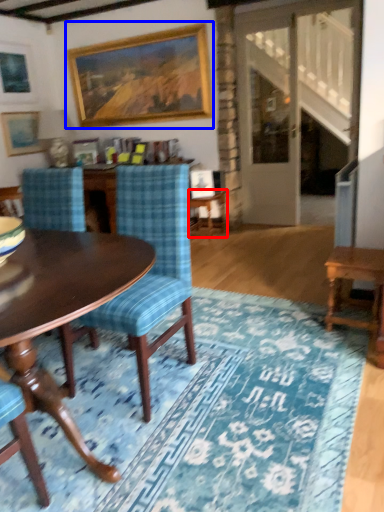
Question: Which object is closer to the camera taking this photo, side table (highlighted by a red box) or picture frame (highlighted by a blue box)?

Choices:
 (A) side table
 (B) picture frame

Answer: (B)